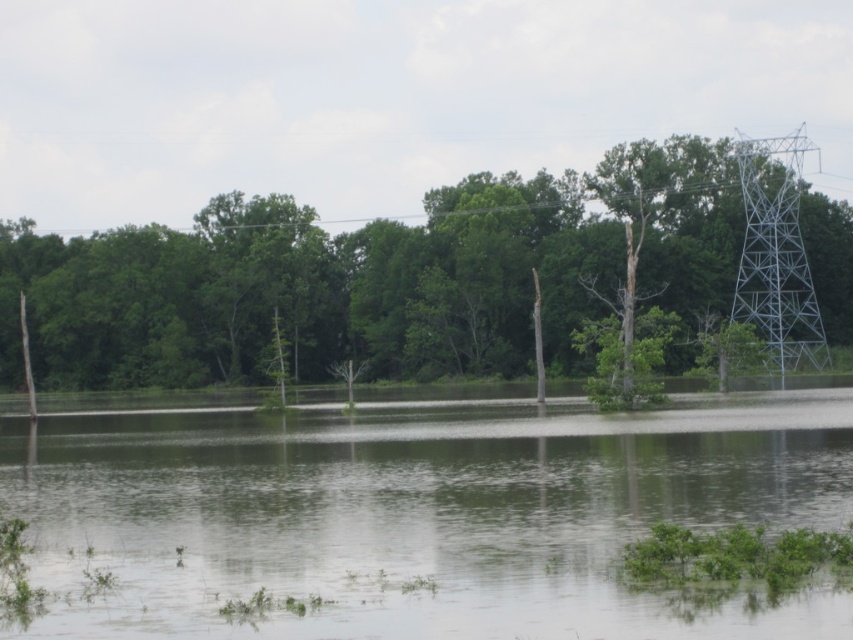
Looking at this image, can you confirm if clear water at center is shorter than green leafy tree at center?

Yes.

Who is positioned more to the right, clear water at center or green leafy tree at center?

From the viewer's perspective, clear water at center appears more on the right side.

Who is more distant from viewer, (801, 401) or (322, 362)?

Point (322, 362)

What are the coordinates of `clear water at center` in the screenshot? It's located at (421, 513).

Is the position of green leafy tree at center more distant than that of metallic gray tower at right?

No, green leafy tree at center is closer to the viewer.

Is green leafy tree at center shorter than metallic gray tower at right?

Yes.

Does point (488, 337) lie in front of point (787, 340)?

No, it is behind (787, 340).

This screenshot has height=640, width=853. What are the coordinates of `green leafy tree at center` in the screenshot? It's located at (311, 289).

Between clear water at center and metallic gray tower at right, which one has less height?

With less height is clear water at center.

Is point (791, 524) farther from camera compared to point (759, 161)?

No, it is in front of (759, 161).

Where is `clear water at center`? clear water at center is located at coordinates (421, 513).